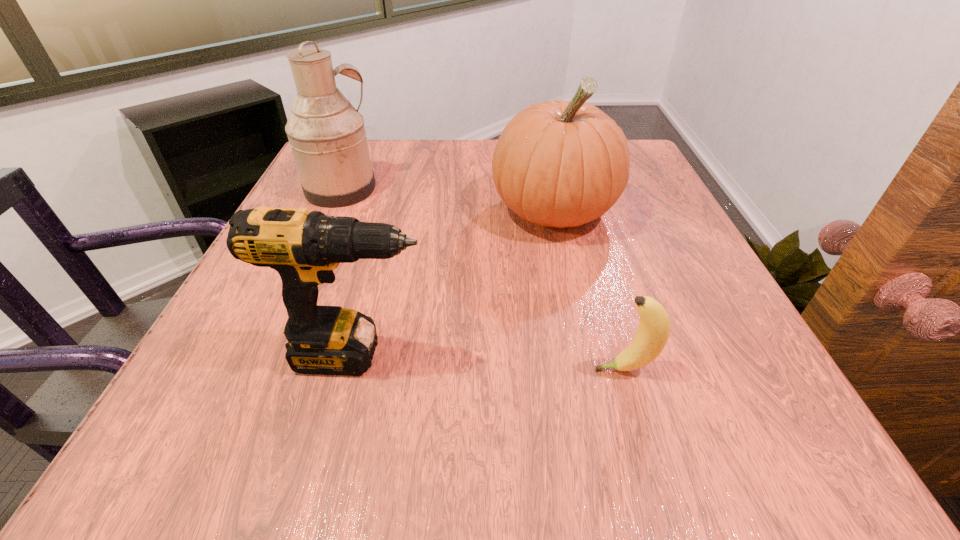
Where is `free space between the pumpkin and the pitcher`? free space between the pumpkin and the pitcher is located at coordinates (447, 200).

What are the coordinates of `object that is the third closest to the shortest object` in the screenshot? It's located at (327, 136).

Find the location of a particular element. The image size is (960, 540). the closest object to the pumpkin is located at coordinates (304, 247).